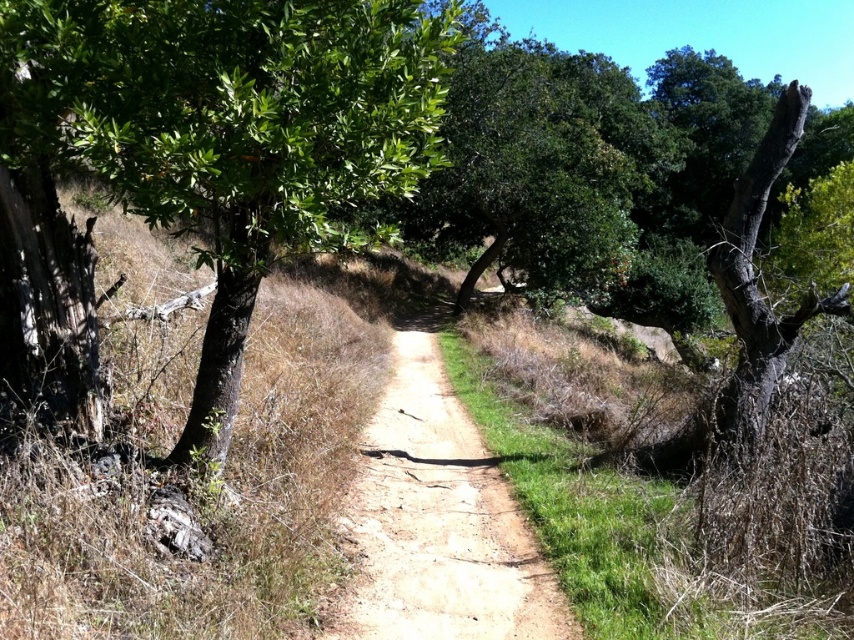
Looking at this image, you are a hiker walking along the dirt path at center and want to reach the green leafy tree at left. Is the tree blocking your path?

The green leafy tree at left is in front of the dirt path at center, so it is blocking your path.

From the picture: You are standing at the camera position and want to take a photo of the green leafy tree at left. If your camera can focus on objects up to 10 feet away, will you be able to capture the tree clearly?

The green leafy tree at left is 8.25 feet away from the camera, which is within the camera focus range of up to 10 feet. Therefore, you can capture the tree clearly.